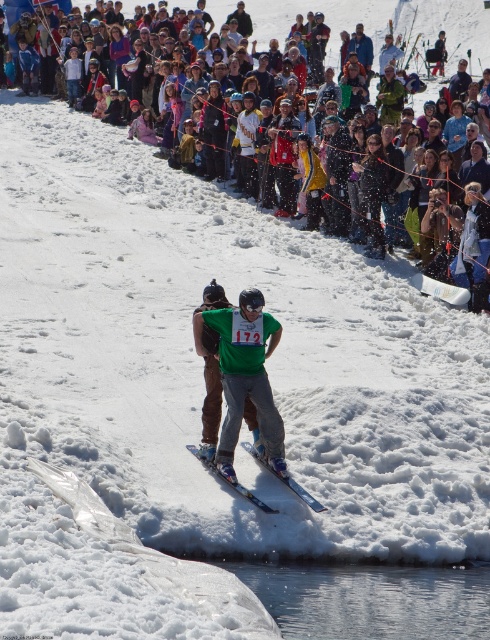
Consider the image. Between multicolored fabric crowd at upper center and shiny blue skis at center, which one is positioned higher?

multicolored fabric crowd at upper center is above.

From the picture: Who is taller, multicolored fabric crowd at upper center or shiny blue skis at center?

multicolored fabric crowd at upper center

From the picture: Who is more forward, (485, 49) or (261, 508)?

Point (261, 508)

Where is `multicolored fabric crowd at upper center`? This screenshot has width=490, height=640. multicolored fabric crowd at upper center is located at coordinates (386, 28).

Measure the distance between green fabric snowboarder at center and shiny blue skis at center.

1.05 meters

Between green fabric snowboarder at center and shiny blue skis at center, which one is positioned higher?

green fabric snowboarder at center is higher up.

What do you see at coordinates (245, 376) in the screenshot? I see `green fabric snowboarder at center` at bounding box center [245, 376].

Where is `green fabric snowboarder at center`? The height and width of the screenshot is (640, 490). green fabric snowboarder at center is located at coordinates (245, 376).

Which is below, multicolored fabric crowd at upper center or green fabric snowboarder at center?

green fabric snowboarder at center

Between point (342, 0) and point (245, 326), which one is positioned behind?

Point (342, 0)

At what (x,y) coordinates should I click in order to perform the action: click on multicolored fabric crowd at upper center. Please return your answer as a coordinate pair (x, y). This screenshot has height=640, width=490. Looking at the image, I should click on (386, 28).